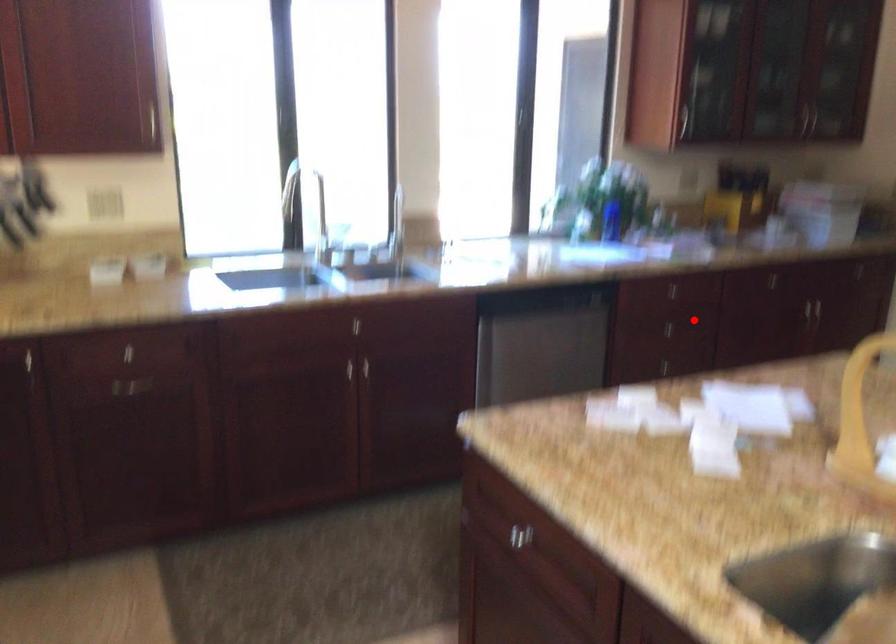
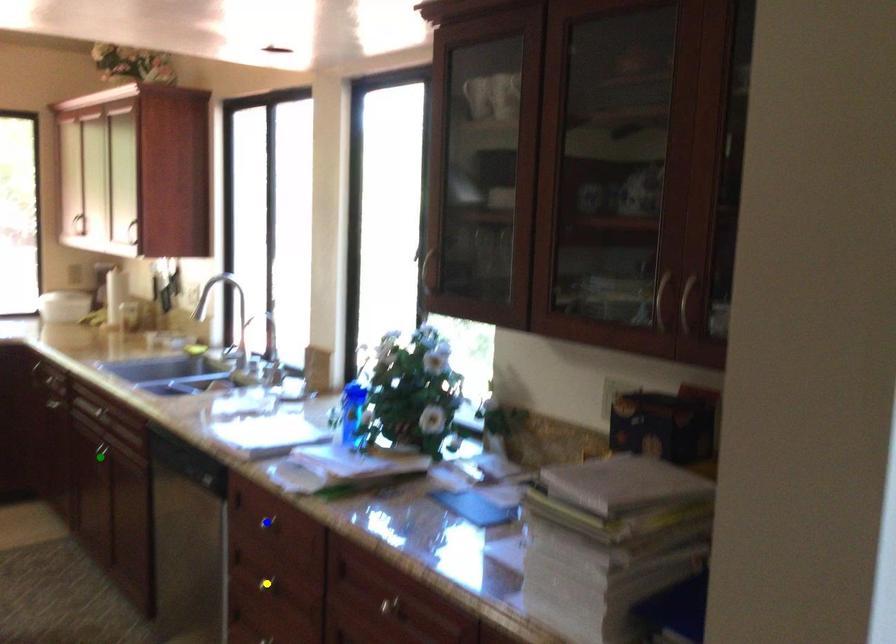
Question: I am providing you with two images of the same scene from different viewpoints. A red point is marked on the first image. You are given multiple points on the second image. Which mark in image 2 goes with the point in image 1?

Choices:
 (A) yellow point
 (B) blue point
 (C) green point

Answer: (A)